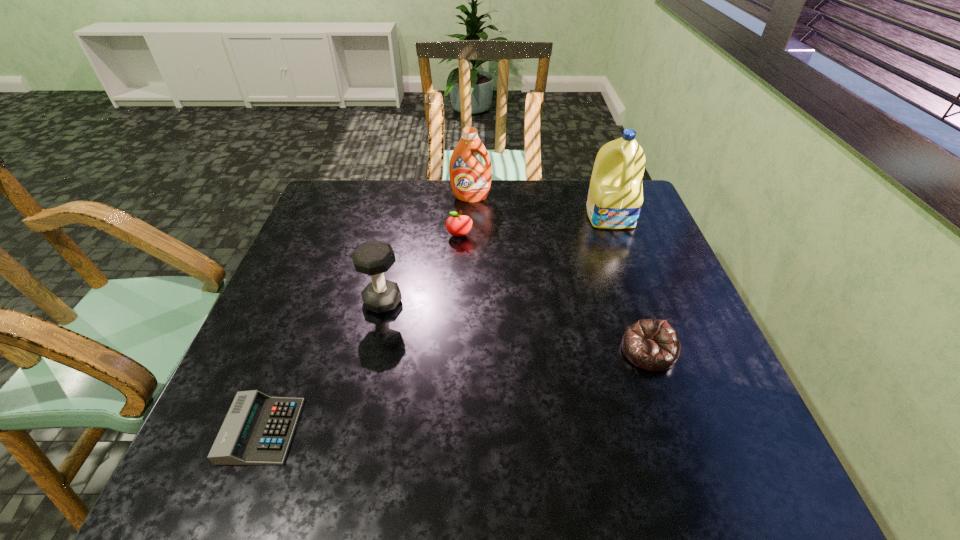
Where is `free location that satisfies the following two spatial constraints: 1. on the front side of the dumbbell; 2. on the left side of the fifth tallest object`? This screenshot has width=960, height=540. free location that satisfies the following two spatial constraints: 1. on the front side of the dumbbell; 2. on the left side of the fifth tallest object is located at coordinates (372, 351).